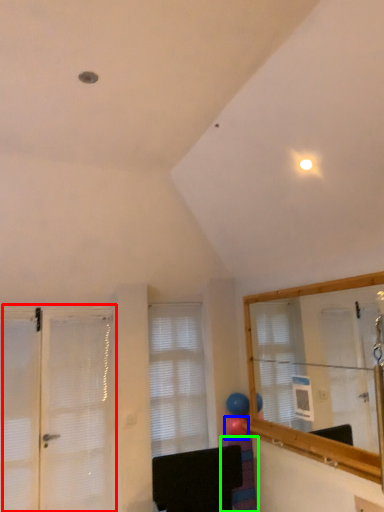
Question: Considering the real-world distances, which object is closest to door (highlighted by a red box)? balloon (highlighted by a blue box) or furniture (highlighted by a green box).

Choices:
 (A) balloon
 (B) furniture

Answer: (B)